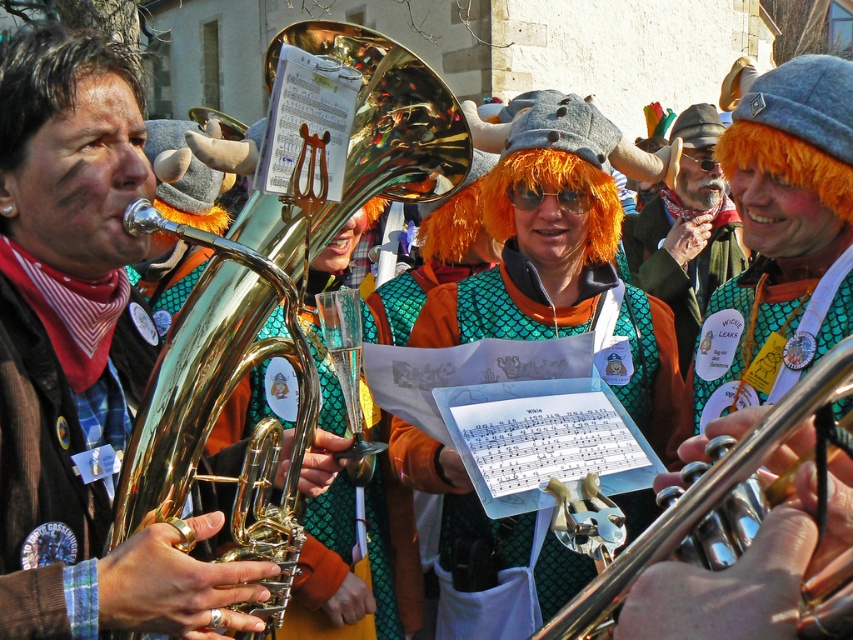
Question: Is gold brass trumpet at left thinner than orange synthetic wig at upper right?

Choices:
 (A) no
 (B) yes

Answer: (B)

Question: Which object is positioned closest to the orange synthetic wig at center?

Choices:
 (A) orange wig at center
 (B) orange synthetic wig at upper right
 (C) silver metallic trumpet at center

Answer: (B)

Question: Among these points, which one is nearest to the camera?

Choices:
 (A) (369, 44)
 (B) (635, 548)
 (C) (721, 189)

Answer: (B)

Question: Observing the image, what is the correct spatial positioning of gold brass trumpet at left in reference to silver metallic trumpet at center?

Choices:
 (A) left
 (B) right

Answer: (A)

Question: Is orange wig at center below orange synthetic wig at center?

Choices:
 (A) no
 (B) yes

Answer: (B)

Question: Which point is closer to the camera taking this photo?

Choices:
 (A) (149, 490)
 (B) (482, 592)
 (C) (762, 148)
 (D) (685, 241)

Answer: (A)